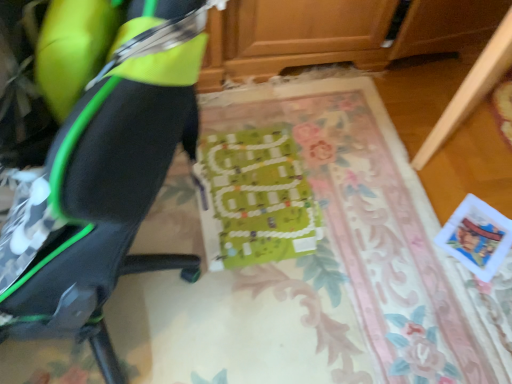
Question: In terms of height, does green fabric board at center look taller or shorter compared to matte black chair at left?

Choices:
 (A) tall
 (B) short

Answer: (B)

Question: Looking at their shapes, would you say green fabric board at center is wider or thinner than matte black chair at left?

Choices:
 (A) wide
 (B) thin

Answer: (A)

Question: Estimate the real-world distances between objects in this image. Which object is farther from the green fabric board at center?

Choices:
 (A) wooden drawer at lower right
 (B) matte black chair at left

Answer: (B)

Question: Which object is the closest to the matte black chair at left?

Choices:
 (A) green fabric board at center
 (B) wooden drawer at lower right

Answer: (A)